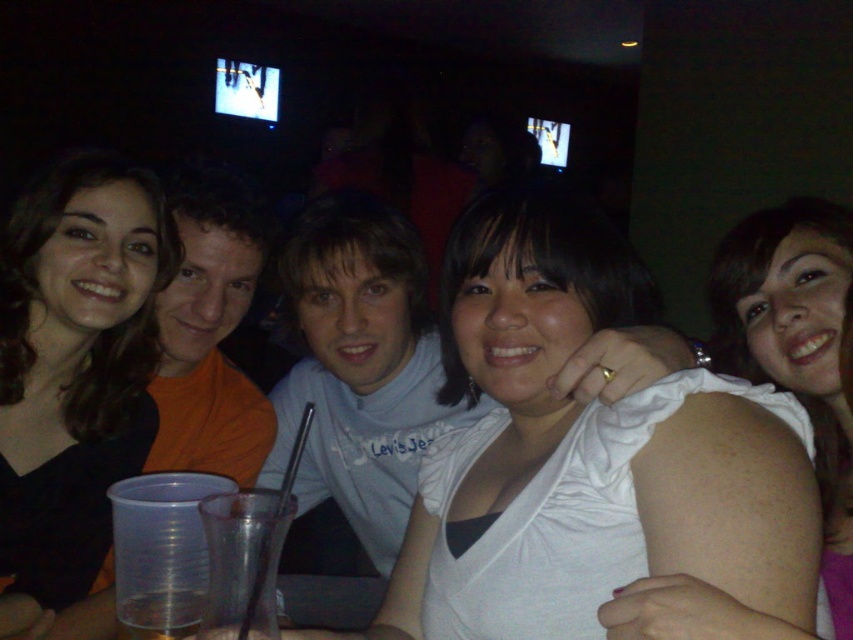
Between white cotton shirt at center and white matte shoulder at upper right, which one has less height?

With less height is white matte shoulder at upper right.

From the picture: Who is taller, white cotton shirt at center or white matte shoulder at upper right?

With more height is white cotton shirt at center.

Which is behind, point (364, 385) or point (758, 364)?

Positioned behind is point (364, 385).

Locate an element on the screen. The width and height of the screenshot is (853, 640). white cotton shirt at center is located at coordinates (360, 369).

Image resolution: width=853 pixels, height=640 pixels. In order to click on white matte shirt at center in this screenshot , I will do `click(587, 451)`.

Consider the image. Who is shorter, white matte shirt at center or white matte shoulder at upper right?

With less height is white matte shirt at center.

Does point (643, 428) come closer to viewer compared to point (714, 259)?

Yes.

At what (x,y) coordinates should I click in order to perform the action: click on white matte shirt at center. Please return your answer as a coordinate pair (x, y). Image resolution: width=853 pixels, height=640 pixels. Looking at the image, I should click on (587, 451).

Between point (566, 500) and point (199, 612), which one is positioned behind?

Point (199, 612)

Is white matte shirt at center bigger than clear plastic cup at lower left?

Yes, white matte shirt at center is bigger than clear plastic cup at lower left.

I want to click on white matte shirt at center, so click(587, 451).